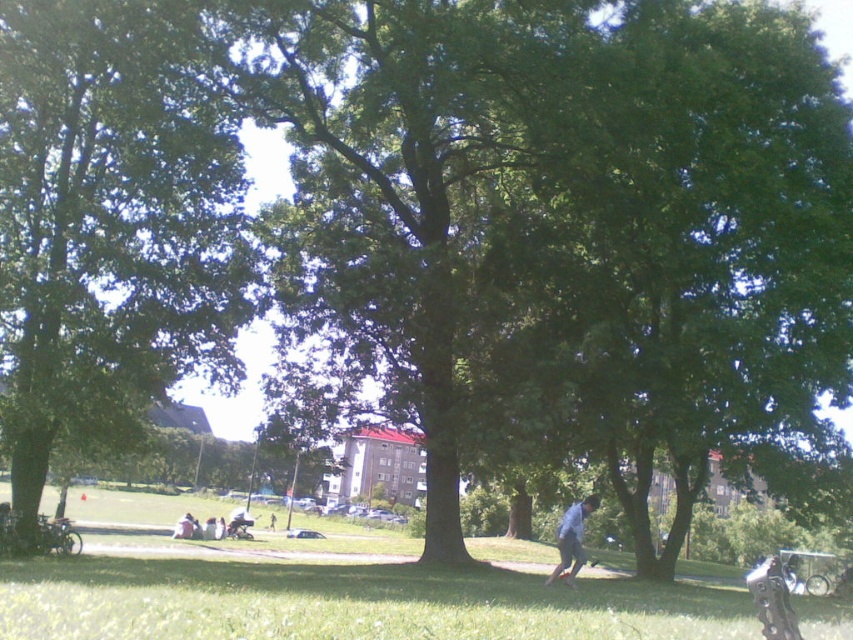
You are planning to take a photo of the light blue denim jeans at lower right and dark blue jeans at center in the park. The camera you are using has a maximum focus range of 35 meters. Will you be able to capture both subjects clearly in the same photo without moving the camera?

The light blue denim jeans at lower right is 37.05 meters from dark blue jeans at center. Since the camera can only focus up to 35 meters, the distance between them exceeds the maximum focus range. Therefore, you cannot capture both subjects clearly in the same photo without moving the camera.

You are a photographer trying to capture a candid shot of the light brown leather jacket at lower center and the dark blue jeans at center. Since you want both subjects to be in focus, you need to know their relative sizes in the frame. Which object appears smaller in the photo?

The light brown leather jacket at lower center appears smaller than the dark blue jeans at center in the photo.

In the scene shown: You are a photographer standing in the park and want to capture a photo of the green grass at lower center and the light blue denim jeans at lower right. Which object is closer to the camera based on their positions?

The light blue denim jeans at lower right are closer to the camera because the green grass at lower center is positioned below them, indicating it is further away.